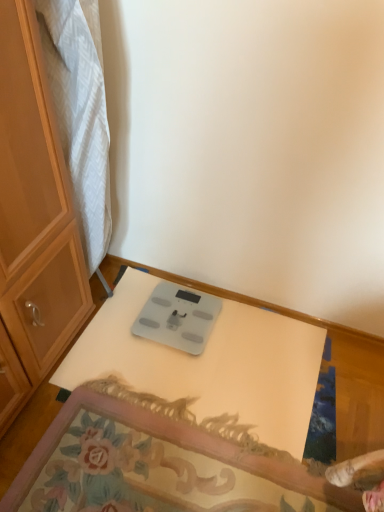
Find the location of a particular element. free space in front of silver metallic scale at center is located at coordinates (180, 375).